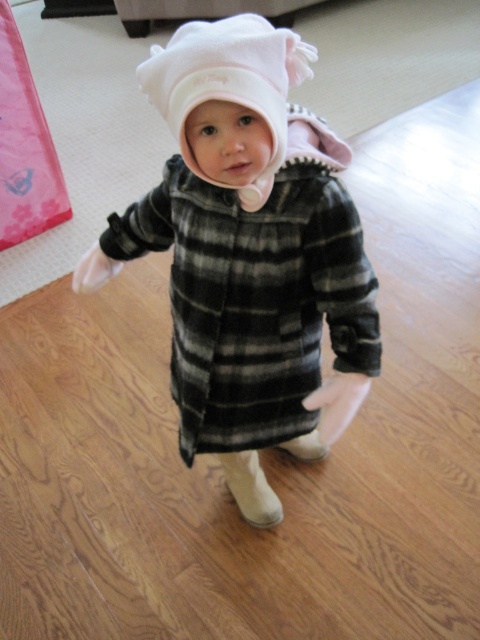
Is fluffy white hat at center bigger than white fleece hat at center?

Correct, fluffy white hat at center is larger in size than white fleece hat at center.

Is fluffy white hat at center in front of white fleece hat at center?

No.

Which is in front, point (298, 456) or point (187, 161)?

Point (187, 161) is in front.

The height and width of the screenshot is (640, 480). I want to click on fluffy white hat at center, so click(251, 253).